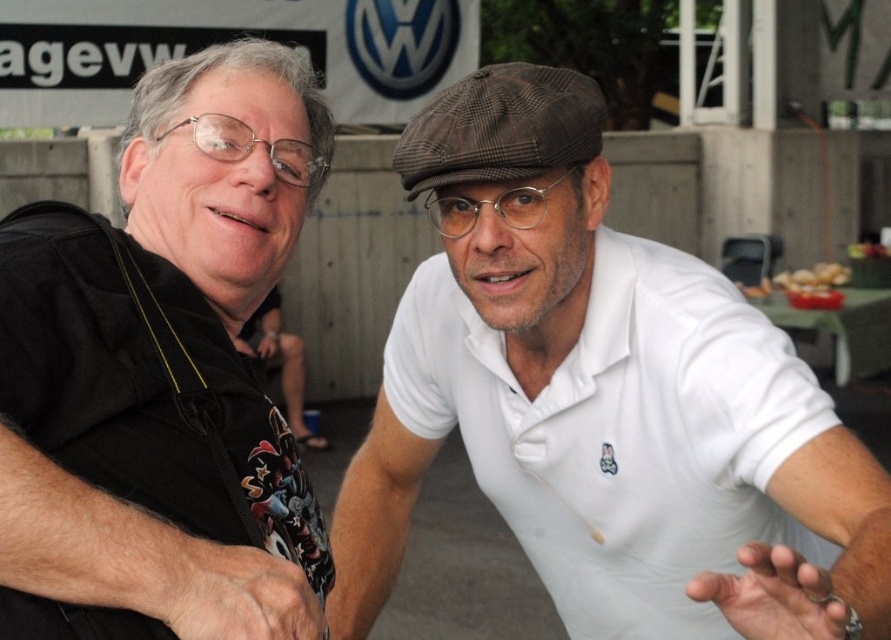
Question: Is white cotton shirt at center smaller than black matte shirt at left?

Choices:
 (A) yes
 (B) no

Answer: (B)

Question: Which of the following is the closest to the observer?

Choices:
 (A) black matte shirt at left
 (B) white cotton shirt at center

Answer: (B)

Question: Is white cotton shirt at center thinner than brown crumbly bread at right?

Choices:
 (A) yes
 (B) no

Answer: (A)

Question: Considering the real-world distances, which object is farthest from the black matte shirt at left?

Choices:
 (A) brown crumbly bread at right
 (B) white cotton shirt at center

Answer: (A)

Question: Does black matte shirt at left have a greater width compared to brown crumbly bread at right?

Choices:
 (A) no
 (B) yes

Answer: (A)

Question: Which of the following is the farthest from the observer?

Choices:
 (A) white cotton shirt at center
 (B) black matte shirt at left
 (C) brown crumbly bread at right

Answer: (C)